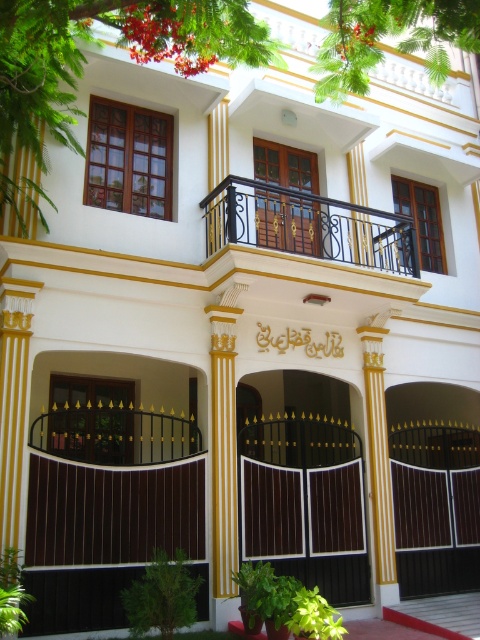
You are standing in front of the building and want to take a photo. You notice two points marked on the building facade. The first point is at coordinate point(x=248, y=433) and the second is at point(x=298, y=198). Which point will appear closer to the bottom of your camera view?

Point(x=248, y=433) is further to the camera than point(x=298, y=198). Therefore, point(x=298, y=198) will appear closer to the bottom of your camera view because it is closer to the camera.

You are an architect reviewing the building design. You need to determine which of the two elements, the dark brown wooden gate at center or the black wrought iron balcony at upper center, requires more space for installation. Based on the provided image, which one would you prioritize for space allocation?

The dark brown wooden gate at center is smaller than the black wrought iron balcony at upper center, so the balcony requires more space and should be prioritized for space allocation.

You are a delivery person trying to deliver a package to the address in front of the dark brown wooden gate at center and the wooden door at center. The package can only be delivered through the taller structure. Which one should you use?

The dark brown wooden gate at center is taller than the wooden door at center, so you should use the dark brown wooden gate at center to deliver the package.